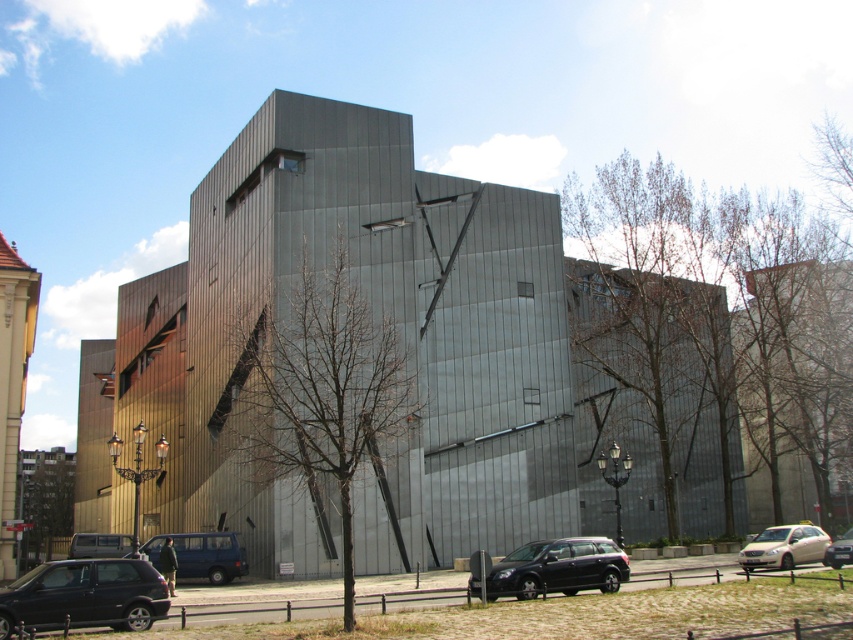
You are a GUI agent. You are given a task and a screenshot of the screen. Output one action in this format:
    pyautogui.click(x=<x>, y=<y>)
    Task: Click on the green leafy tree at lower left
    
    Given the screenshot: What is the action you would take?
    pyautogui.click(x=45, y=497)

Which is behind, point (26, 493) or point (820, 540)?

The point (26, 493) is more distant.

In order to click on green leafy tree at lower left in this screenshot , I will do `click(45, 497)`.

You are a GUI agent. You are given a task and a screenshot of the screen. Output one action in this format:
    pyautogui.click(x=<x>, y=<y>)
    Task: Click on the green leafy tree at lower left
    This screenshot has width=853, height=640.
    Given the screenshot: What is the action you would take?
    pyautogui.click(x=45, y=497)

Does shiny black suv at center appear under green leafy tree at lower left?

No.

Which is above, shiny black suv at center or green leafy tree at lower left?

shiny black suv at center

Identify the location of shiny black suv at center. This screenshot has height=640, width=853. (558, 566).

Image resolution: width=853 pixels, height=640 pixels. In order to click on shiny black suv at center in this screenshot , I will do `click(558, 566)`.

Which of these two, matte black car at lower left or white glossy sedan at lower right, stands taller?

Standing taller between the two is matte black car at lower left.

Between matte black car at lower left and white glossy sedan at lower right, which one appears on the right side from the viewer's perspective?

white glossy sedan at lower right

The width and height of the screenshot is (853, 640). Describe the element at coordinates (84, 595) in the screenshot. I see `matte black car at lower left` at that location.

Find the location of a particular element. This screenshot has height=640, width=853. matte black car at lower left is located at coordinates (84, 595).